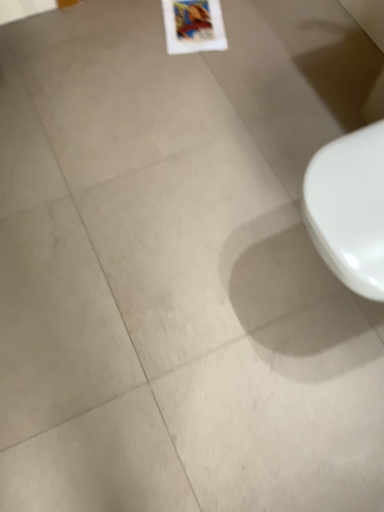
Describe the element at coordinates (193, 26) in the screenshot. I see `matte paper magazine at upper center` at that location.

What is the approximate width of matte paper magazine at upper center?

matte paper magazine at upper center is 12.14 inches wide.

In order to face matte paper magazine at upper center, should I rotate leftwards or rightwards?

It's best to rotate right around 0.168 degrees.

Identify the location of matte paper magazine at upper center. The image size is (384, 512). (193, 26).

The width and height of the screenshot is (384, 512). Find the location of `matte paper magazine at upper center`. matte paper magazine at upper center is located at coordinates (193, 26).